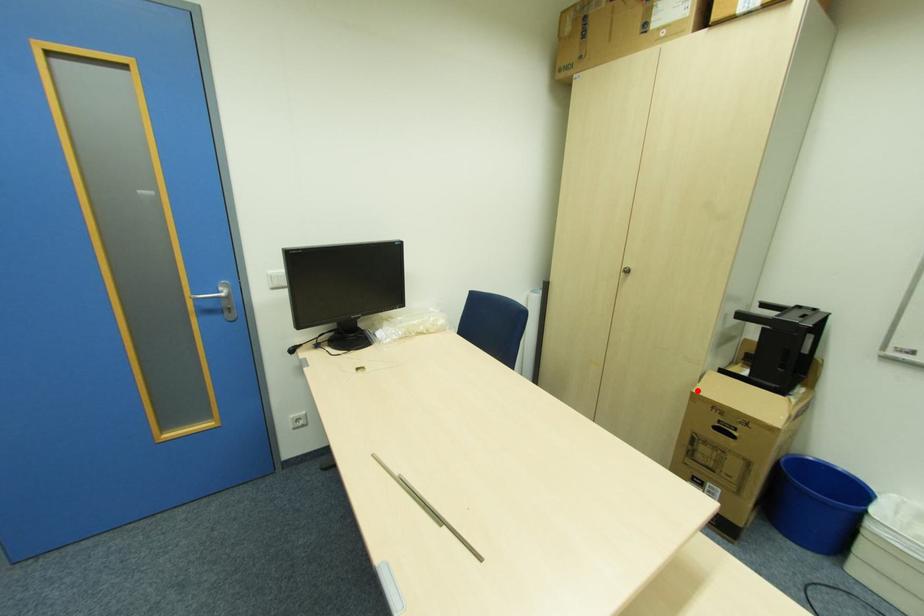
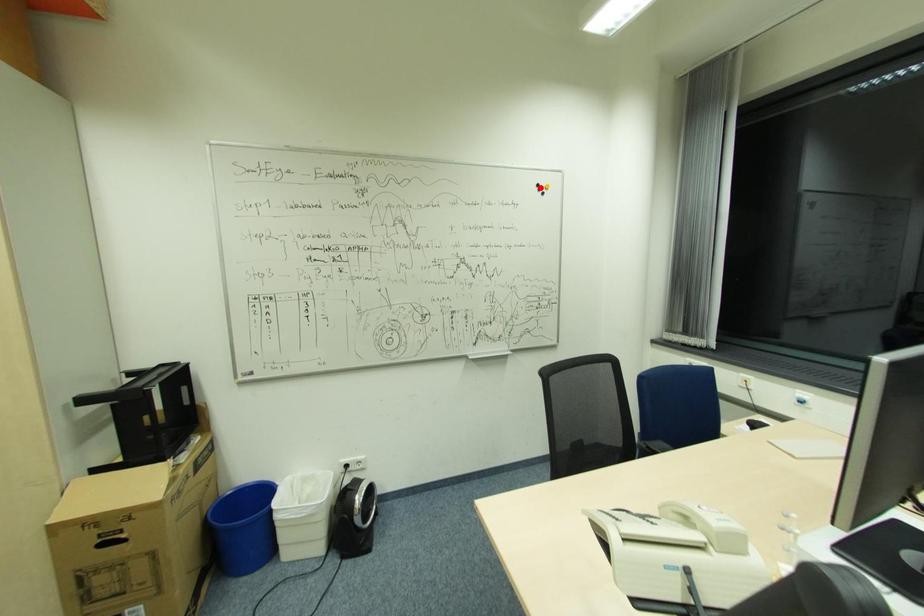
I am providing you with two images of the same scene from different viewpoints. A red point is marked on the first image and another point is marked on the second image. Does the point marked in image1 correspond to the same location as the one in image2?

No